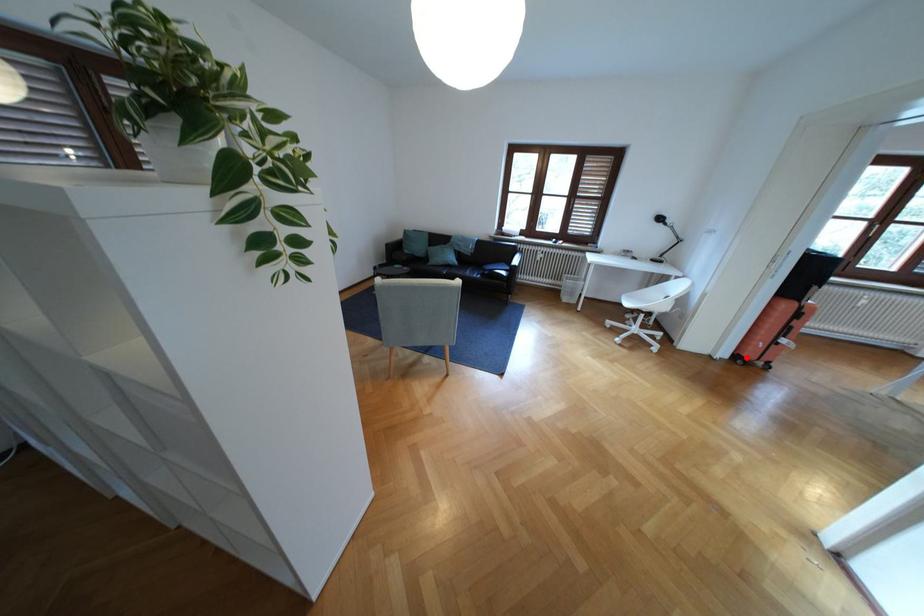
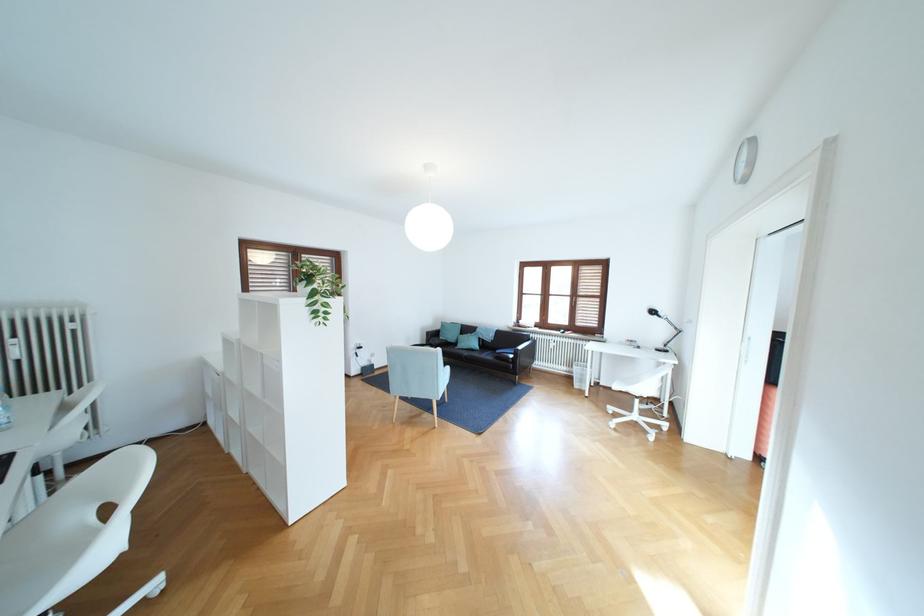
Question: I am providing you with two images of the same scene from different viewpoints. A red point is marked on the first image. At the location where the point appears in image 1, is it still visible in image 2?

Choices:
 (A) Yes
 (B) No

Answer: (B)